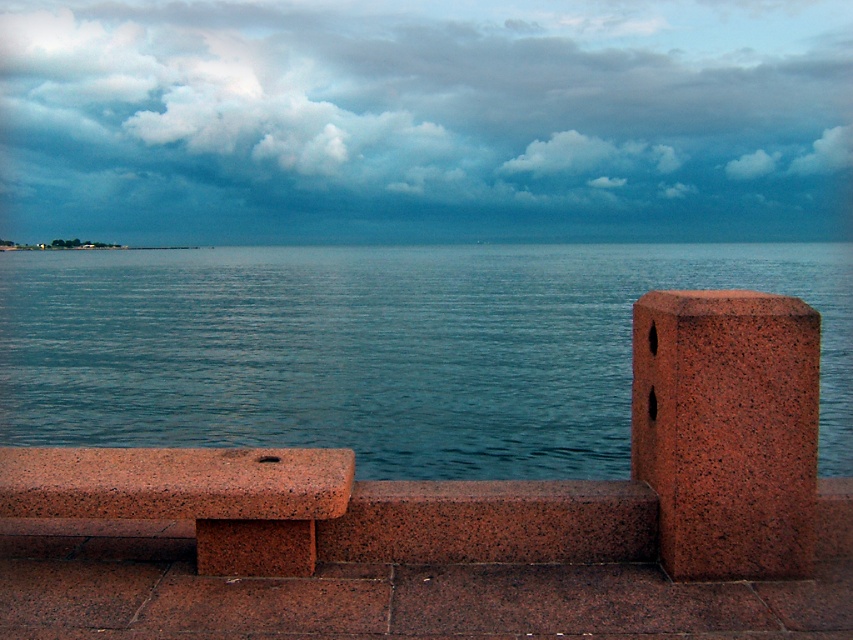
In the scene shown: You are sitting on the granite bench at left and want to look at the blue water at center. Which direction should you turn your head to see it?

Since the blue water at center is positioned over the granite bench at left, you should look forward or slightly upward to see the blue water at center directly in front of you.